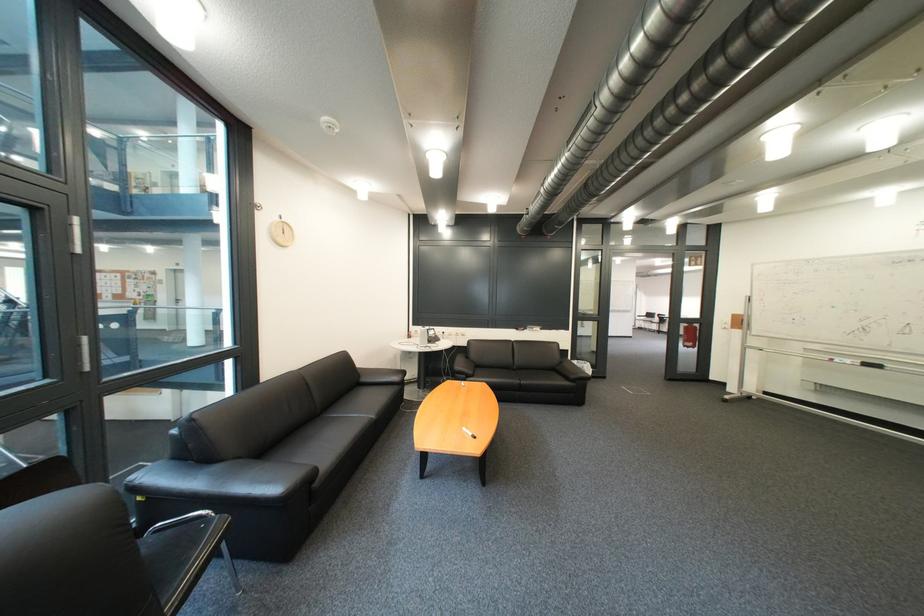
Where would you resting arm the metal chair armrest? Please return your answer as a coordinate pair (x, y).

(179, 521)